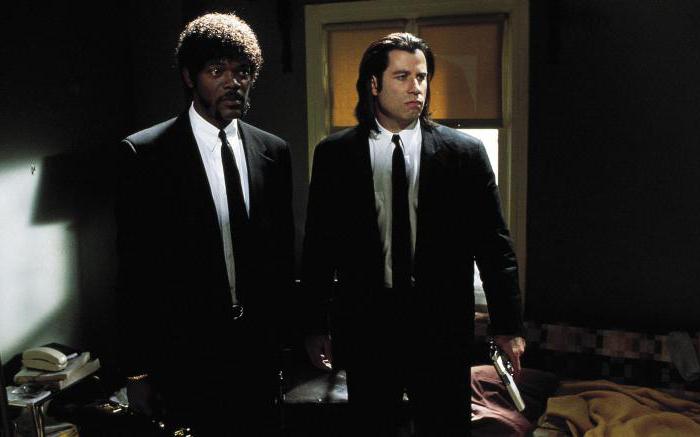
Identify the location of window shade. Image resolution: width=700 pixels, height=437 pixels. (495, 93).